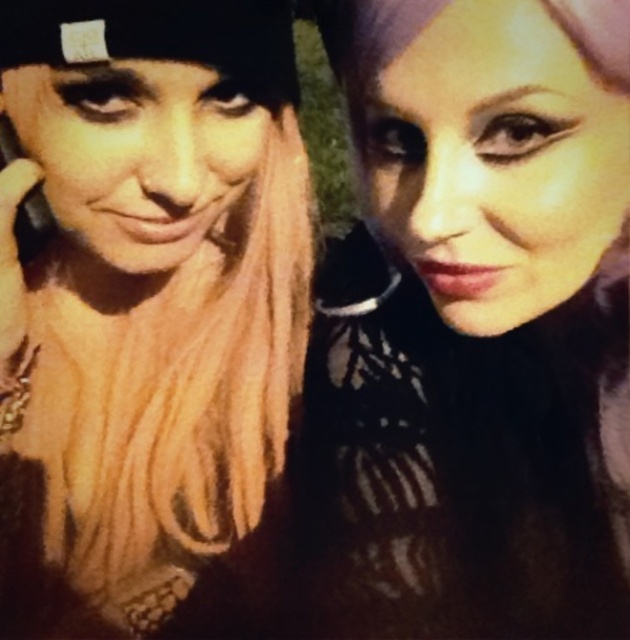
You are a photographer adjusting the lighting for a portrait. You need to ensure that the matte black hair at center is properly lit. Where should you position the light relative to the camera to achieve this?

The matte black hair at center is located at point [472,326]. To properly light it, position the light slightly to the left of the camera so that the light falls directly on the matte black hair at center.

Based on the scene description, which object, the matte black hair at center or the matte black beanie at upper left, has a greater width?

The matte black hair at center is wider than the matte black beanie at upper left according to the description.

You are a photographer trying to capture a portrait of the matte black hair at center and the matte black beanie at upper left. To ensure both subjects are in frame, which direction should you move your camera? Explain your reasoning based on their positions.

The matte black hair at center is to the right of the matte black beanie at upper left. Therefore, to include both in the frame, you should move the camera to the right so that the matte black beanie at upper left comes into view while keeping the matte black hair at center within the shot.